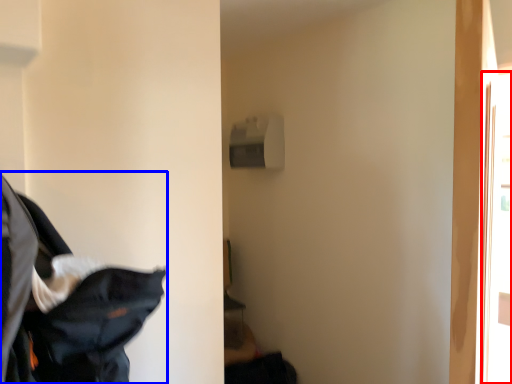
Question: Which object appears farthest to the camera in this image, screen door (highlighted by a red box) or laundry (highlighted by a blue box)?

Choices:
 (A) screen door
 (B) laundry

Answer: (A)